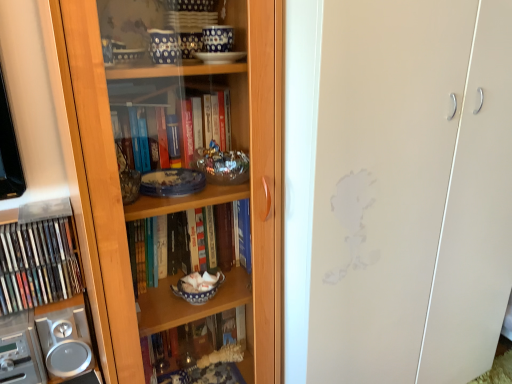
Question: In the image, is transparent glass cabinet at center on the left side or the right side of silver metallic speaker at lower left?

Choices:
 (A) right
 (B) left

Answer: (A)

Question: From the image's perspective, is transparent glass cabinet at center above or below silver metallic speaker at lower left?

Choices:
 (A) below
 (B) above

Answer: (B)

Question: Which is farther from the transparent glass cabinet at center?

Choices:
 (A) silver metallic speaker at lower left
 (B) matte plastic books at left
 (C) wooden bookcase at left

Answer: (B)

Question: Which object is the farthest from the wooden bookcase at left?

Choices:
 (A) silver metallic speaker at lower left
 (B) transparent glass cabinet at center
 (C) matte plastic books at left

Answer: (C)